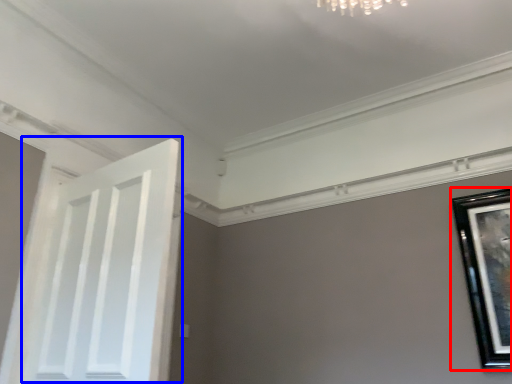
Question: Among these objects, which one is nearest to the camera, picture frame (highlighted by a red box) or door (highlighted by a blue box)?

Choices:
 (A) picture frame
 (B) door

Answer: (B)